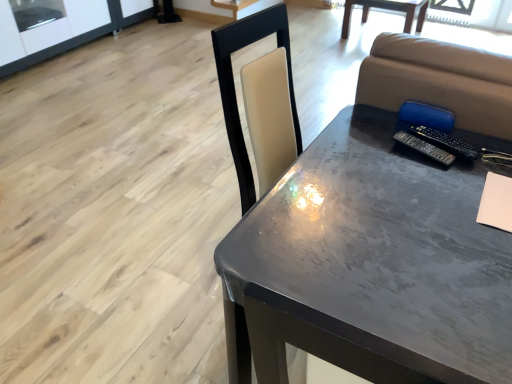
Identify the location of vacant space that is to the left of metallic gray table at center, acting as the 2th table starting from the top. The image size is (512, 384). (156, 310).